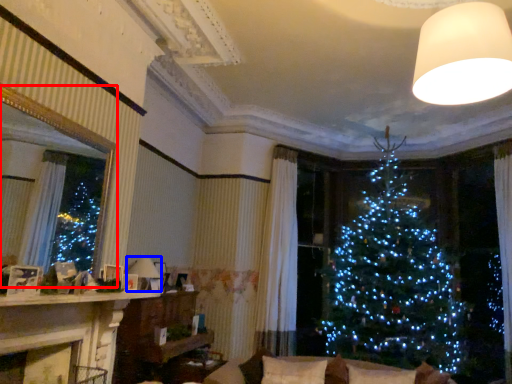
Question: Which point is further to the camera, window screen (highlighted by a red box) or lamp (highlighted by a blue box)?

Choices:
 (A) window screen
 (B) lamp

Answer: (B)